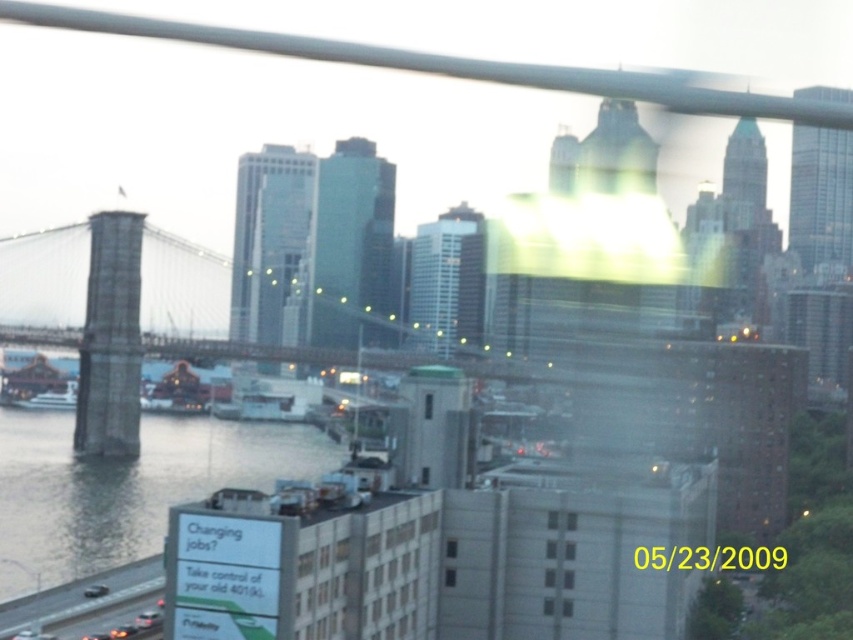
Question: Observing the image, what is the correct spatial positioning of clear water at lower left in reference to white matte boat at left?

Choices:
 (A) below
 (B) above

Answer: (A)

Question: Which of the following is the farthest from the observer?

Choices:
 (A) (53, 428)
 (B) (64, 394)
 (C) (206, 406)
 (D) (183, 320)

Answer: (B)

Question: Considering the real-world distances, which object is closest to the concrete bridge at center?

Choices:
 (A) white matte boat at left
 (B) wooden ship at center
 (C) clear water at lower left

Answer: (B)

Question: Which object is closer to the camera taking this photo?

Choices:
 (A) clear water at lower left
 (B) white matte boat at left

Answer: (A)

Question: Can you confirm if concrete bridge at center is smaller than wooden ship at center?

Choices:
 (A) yes
 (B) no

Answer: (B)

Question: Where is concrete bridge at center located in relation to white matte boat at left in the image?

Choices:
 (A) below
 (B) above

Answer: (B)